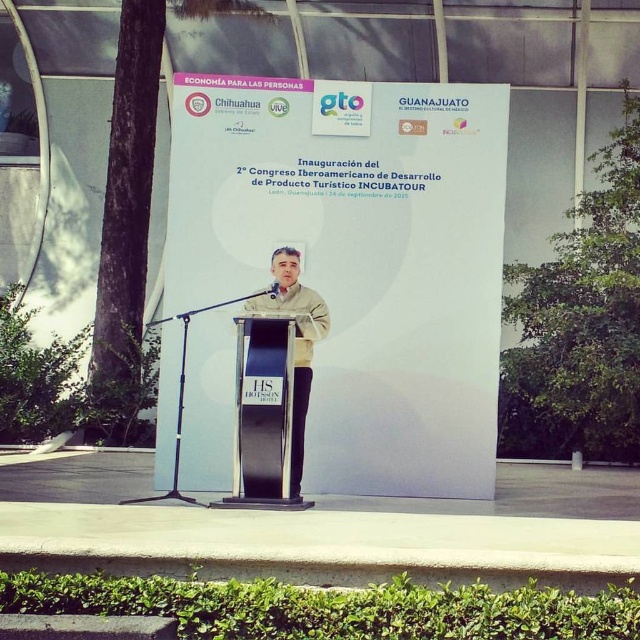
Question: Does black polished wood podium at center have a greater width compared to light beige fabric shirt at center?

Choices:
 (A) no
 (B) yes

Answer: (B)

Question: Does black polished wood podium at center appear over light beige fabric shirt at center?

Choices:
 (A) yes
 (B) no

Answer: (B)

Question: Does black polished wood podium at center appear over light beige fabric shirt at center?

Choices:
 (A) yes
 (B) no

Answer: (B)

Question: Which point appears closest to the camera in this image?

Choices:
 (A) (269, 260)
 (B) (264, 317)

Answer: (B)

Question: Which object appears farthest from the camera in this image?

Choices:
 (A) black polished wood podium at center
 (B) light beige fabric shirt at center

Answer: (B)